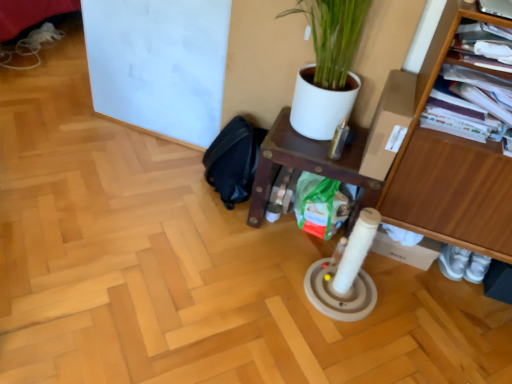
Describe the element at coordinates (451, 168) in the screenshot. I see `wooden shelf at right` at that location.

Identify the location of wooden shelf at center. Image resolution: width=512 pixels, height=384 pixels. (307, 164).

Does wooden shelf at center have a lesser height compared to wooden shelf at right?

Correct, wooden shelf at center is not as tall as wooden shelf at right.

From a real-world perspective, who is located higher, wooden shelf at center or wooden shelf at right?

wooden shelf at right.

Is wooden shelf at center next to wooden shelf at right?

No, wooden shelf at center is not making contact with wooden shelf at right.

From the image's perspective, which is below, wooden shelf at center or wooden shelf at right?

From the image's view, wooden shelf at center is below.

From a real-world perspective, is black fabric swivel chair at lower center above or below wooden shelf at right?

From a real-world perspective, black fabric swivel chair at lower center is physically below wooden shelf at right.

This screenshot has height=384, width=512. Identify the location of furniture to the right of black fabric swivel chair at lower center. (451, 168).

Which object is further away from the camera taking this photo, black fabric swivel chair at lower center or wooden shelf at right?

black fabric swivel chair at lower center is more distant.

What's the angular difference between black fabric swivel chair at lower center and wooden shelf at right's facing directions?

The angle between the facing direction of black fabric swivel chair at lower center and the facing direction of wooden shelf at right is 0.437 degrees.

From a real-world perspective, which is physically below, wooden shelf at right or black fabric swivel chair at lower center?

In real-world perspective, black fabric swivel chair at lower center is lower.

From their relative heights in the image, would you say wooden shelf at right is taller or shorter than black fabric swivel chair at lower center?

Clearly, wooden shelf at right is taller compared to black fabric swivel chair at lower center.

Is black fabric swivel chair at lower center a part of wooden shelf at right?

No.

In the scene shown: From the image's perspective, is wooden shelf at right beneath black fabric swivel chair at lower center?

Yes.

The width and height of the screenshot is (512, 384). I want to click on shelf on the right of black fabric swivel chair at lower center, so click(x=307, y=164).

Would you say black fabric swivel chair at lower center is to the left or to the right of wooden shelf at center in the picture?

Clearly, black fabric swivel chair at lower center is on the left of wooden shelf at center in the image.

Is black fabric swivel chair at lower center placed right next to wooden shelf at center?

No, black fabric swivel chair at lower center is not in contact with wooden shelf at center.

From a real-world perspective, is black fabric swivel chair at lower center over wooden shelf at center?

No, from a real-world perspective, black fabric swivel chair at lower center is not above wooden shelf at center.

Looking at this image, based on their positions, is wooden shelf at right located to the left or right of wooden shelf at center?

From the image, it's evident that wooden shelf at right is to the right of wooden shelf at center.

Which object is closer to the camera taking this photo, wooden shelf at right or wooden shelf at center?

wooden shelf at right is in front.

Which is in front, point (400, 193) or point (265, 174)?

Point (400, 193)

Considering the positions of objects wooden shelf at center and black fabric swivel chair at lower center in the image provided, who is in front, wooden shelf at center or black fabric swivel chair at lower center?

Positioned in front is wooden shelf at center.

Can you tell me how much wooden shelf at center and black fabric swivel chair at lower center differ in facing direction?

wooden shelf at center and black fabric swivel chair at lower center are facing 0.000136 degrees away from each other.

Is wooden shelf at center looking in the opposite direction of black fabric swivel chair at lower center?

wooden shelf at center does not have its back to black fabric swivel chair at lower center.

Find the location of a particular element. furniture that is above the wooden shelf at center (from the image's perspective) is located at coordinates (451, 168).

This screenshot has height=384, width=512. In order to click on swivel chair that appears on the left of wooden shelf at right in this screenshot , I will do `click(234, 160)`.

Consider the image. Considering their positions, is wooden shelf at right positioned closer to black fabric swivel chair at lower center than wooden shelf at center?

wooden shelf at center is positioned closer to the anchor black fabric swivel chair at lower center.

Looking at this image, based on their spatial positions, is wooden shelf at center or black fabric swivel chair at lower center closer to wooden shelf at right?

wooden shelf at center is positioned closer to the anchor wooden shelf at right.

Looking at the image, which one is located closer to black fabric swivel chair at lower center, wooden shelf at center or wooden shelf at right?

wooden shelf at center is closer to black fabric swivel chair at lower center.

Considering their positions, is black fabric swivel chair at lower center positioned further to wooden shelf at right than wooden shelf at center?

Among the two, black fabric swivel chair at lower center is located further to wooden shelf at right.

From the image, which object appears to be nearer to wooden shelf at center, black fabric swivel chair at lower center or wooden shelf at right?

black fabric swivel chair at lower center lies closer to wooden shelf at center than the other object.

From the image, which object appears to be nearer to wooden shelf at center, wooden shelf at right or black fabric swivel chair at lower center?

black fabric swivel chair at lower center is positioned closer to the anchor wooden shelf at center.

Identify the location of shelf between black fabric swivel chair at lower center and wooden shelf at right. pos(307,164).